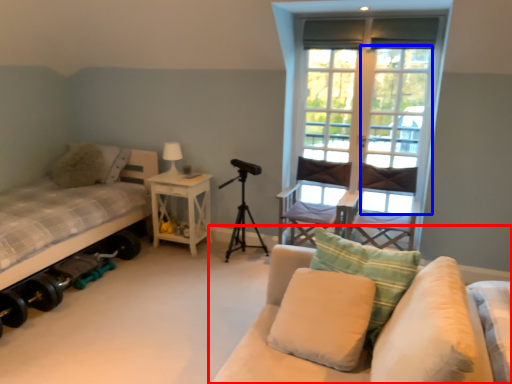
Question: Which of the following is the farthest to the observer, studio couch (highlighted by a red box) or screen door (highlighted by a blue box)?

Choices:
 (A) studio couch
 (B) screen door

Answer: (B)